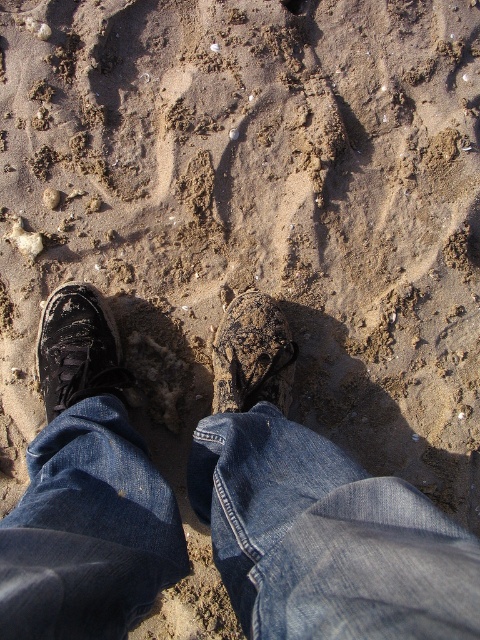
Question: Does denim at center have a smaller size compared to leather textured shoe at center?

Choices:
 (A) no
 (B) yes

Answer: (A)

Question: Among these objects, which one is farthest from the camera?

Choices:
 (A) denim at center
 (B) leather textured shoe at center

Answer: (B)

Question: Which object appears farthest from the camera in this image?

Choices:
 (A) black leather shoe at lower left
 (B) denim at center

Answer: (A)

Question: Does black leather shoe at lower left have a greater width compared to leather textured shoe at center?

Choices:
 (A) yes
 (B) no

Answer: (A)

Question: Is black leather shoe at lower left smaller than leather textured shoe at center?

Choices:
 (A) no
 (B) yes

Answer: (A)

Question: Which of the following is the closest to the observer?

Choices:
 (A) leather textured shoe at center
 (B) denim at center
 (C) black leather shoe at lower left

Answer: (B)